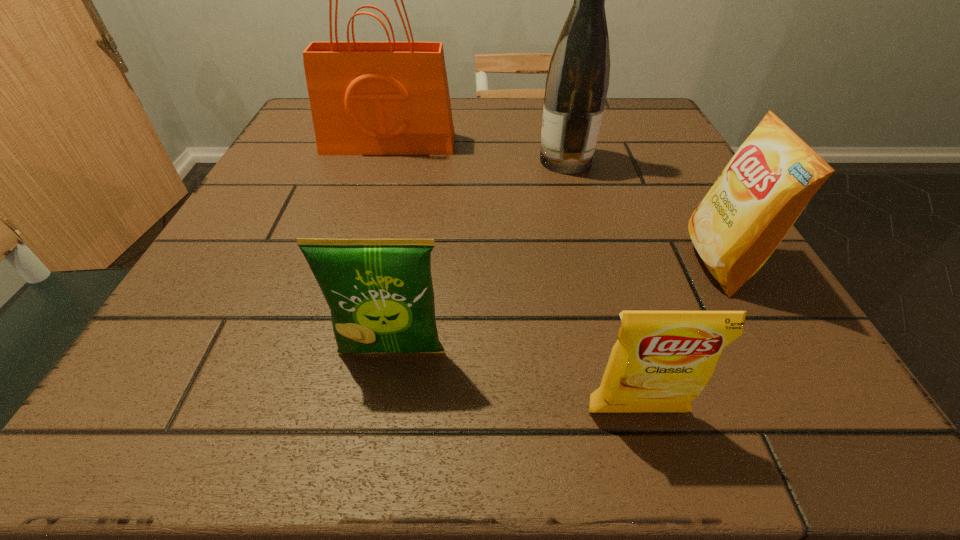
Image resolution: width=960 pixels, height=540 pixels. I want to click on tote bag, so click(367, 98).

Identify the location of wine bottle. The image size is (960, 540). (577, 82).

The height and width of the screenshot is (540, 960). Find the location of `the rightmost crisp (potato chip)`. the rightmost crisp (potato chip) is located at coordinates (759, 195).

The height and width of the screenshot is (540, 960). I want to click on the rightmost object, so click(759, 195).

At what (x,y) coordinates should I click in order to perform the action: click on the leftmost crisp (potato chip). Please return your answer as a coordinate pair (x, y). Image resolution: width=960 pixels, height=540 pixels. Looking at the image, I should click on (380, 292).

Identify the location of the second nearest object. (x=380, y=292).

This screenshot has height=540, width=960. Identify the location of the nearest crisp (potato chip). (662, 360).

Identify the location of the second crisp (potato chip) from right to left. This screenshot has height=540, width=960. (662, 360).

Image resolution: width=960 pixels, height=540 pixels. Identify the location of free spot located on the logo side of the tote bag. (369, 211).

This screenshot has width=960, height=540. What are the coordinates of `vacant space located on the label of the second tallest object` in the screenshot? It's located at (475, 160).